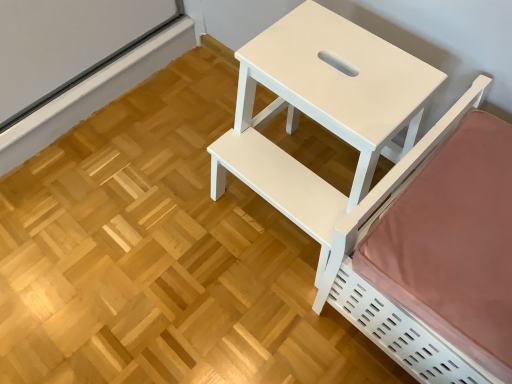
Question: Is white matte bed at right far away from white matte table at center?

Choices:
 (A) yes
 (B) no

Answer: (B)

Question: Is white matte bed at right looking in the opposite direction of white matte table at center?

Choices:
 (A) no
 (B) yes

Answer: (A)

Question: Considering the relative sizes of white matte bed at right and white matte table at center in the image provided, is white matte bed at right shorter than white matte table at center?

Choices:
 (A) no
 (B) yes

Answer: (B)

Question: From the image's perspective, does white matte bed at right appear lower than white matte table at center?

Choices:
 (A) no
 (B) yes

Answer: (B)

Question: Is the depth of white matte bed at right greater than that of white matte table at center?

Choices:
 (A) no
 (B) yes

Answer: (A)

Question: Is white matte bed at right to the right of white matte table at center from the viewer's perspective?

Choices:
 (A) yes
 (B) no

Answer: (A)

Question: Considering the relative sizes of white matte table at center and white matte bed at right in the image provided, is white matte table at center bigger than white matte bed at right?

Choices:
 (A) no
 (B) yes

Answer: (A)

Question: Is the position of white matte table at center more distant than that of white matte bed at right?

Choices:
 (A) no
 (B) yes

Answer: (B)

Question: Can we say white matte table at center lies outside white matte bed at right?

Choices:
 (A) no
 (B) yes

Answer: (B)

Question: Considering the relative sizes of white matte table at center and white matte bed at right in the image provided, is white matte table at center wider than white matte bed at right?

Choices:
 (A) yes
 (B) no

Answer: (B)

Question: Is white matte table at center to the left of white matte bed at right from the viewer's perspective?

Choices:
 (A) no
 (B) yes

Answer: (B)

Question: Is white matte table at center positioned far away from white matte bed at right?

Choices:
 (A) yes
 (B) no

Answer: (B)

Question: Considering the positions of white matte table at center and white matte bed at right in the image, is white matte table at center wider or thinner than white matte bed at right?

Choices:
 (A) wide
 (B) thin

Answer: (B)